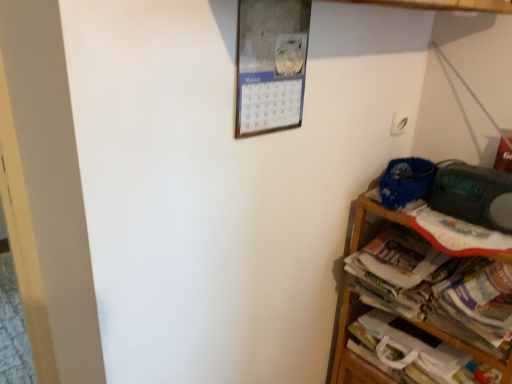
Question: Is white paper magazine at right taller than wooden shelf at right?

Choices:
 (A) yes
 (B) no

Answer: (B)

Question: Is white paper magazine at right not within wooden shelf at right?

Choices:
 (A) yes
 (B) no

Answer: (B)

Question: Is white paper magazine at right oriented towards wooden shelf at right?

Choices:
 (A) yes
 (B) no

Answer: (A)

Question: Considering the relative sizes of white paper magazine at right and wooden shelf at right in the image provided, is white paper magazine at right wider than wooden shelf at right?

Choices:
 (A) no
 (B) yes

Answer: (A)

Question: Is white paper magazine at right with wooden shelf at right?

Choices:
 (A) no
 (B) yes

Answer: (A)

Question: Is the depth of white paper magazine at right greater than that of wooden shelf at right?

Choices:
 (A) no
 (B) yes

Answer: (B)

Question: Is wooden shelf at right at the right side of white paper book at lower right?

Choices:
 (A) no
 (B) yes

Answer: (A)

Question: From the image's perspective, is wooden shelf at right located above white paper book at lower right?

Choices:
 (A) yes
 (B) no

Answer: (A)

Question: Does wooden shelf at right have a smaller size compared to white paper book at lower right?

Choices:
 (A) no
 (B) yes

Answer: (A)

Question: From a real-world perspective, is wooden shelf at right positioned over white paper book at lower right based on gravity?

Choices:
 (A) yes
 (B) no

Answer: (A)

Question: Is wooden shelf at right bigger than white paper book at lower right?

Choices:
 (A) yes
 (B) no

Answer: (A)

Question: Is white paper book at lower right inside wooden shelf at right?

Choices:
 (A) no
 (B) yes

Answer: (B)

Question: Is white paper magazine at right at the left side of white paper book at lower right?

Choices:
 (A) no
 (B) yes

Answer: (B)